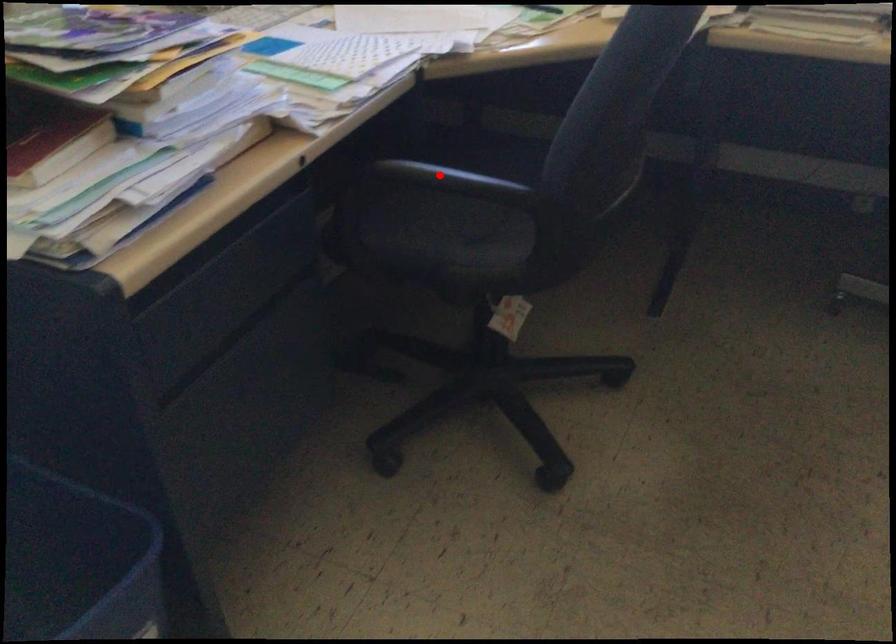
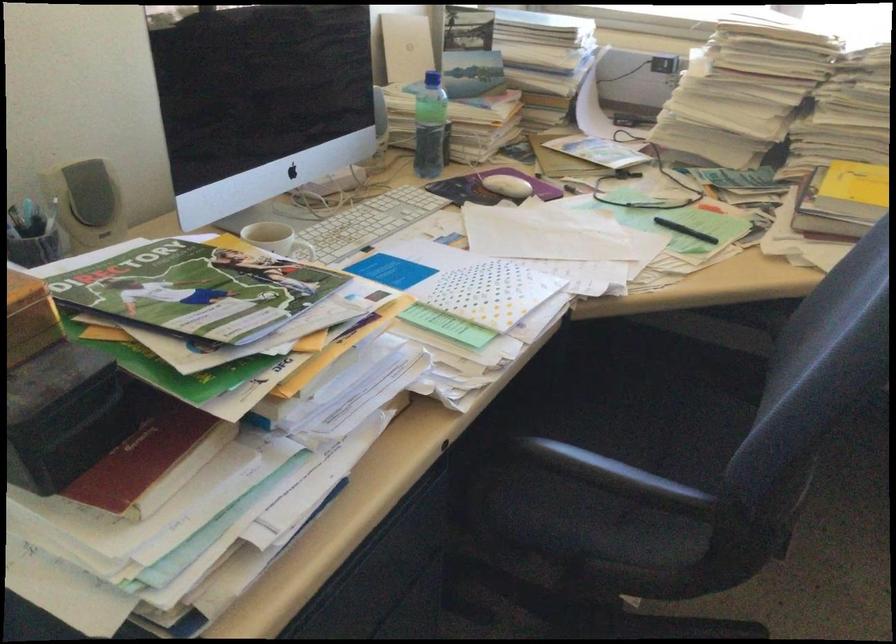
Find the pixel in the second image that matches the highlighted location in the first image.

(614, 474)